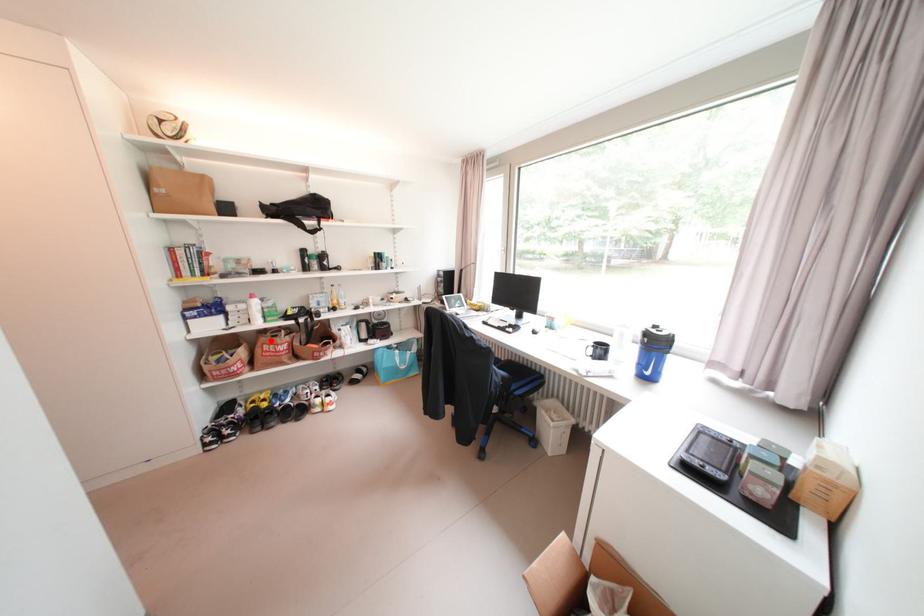
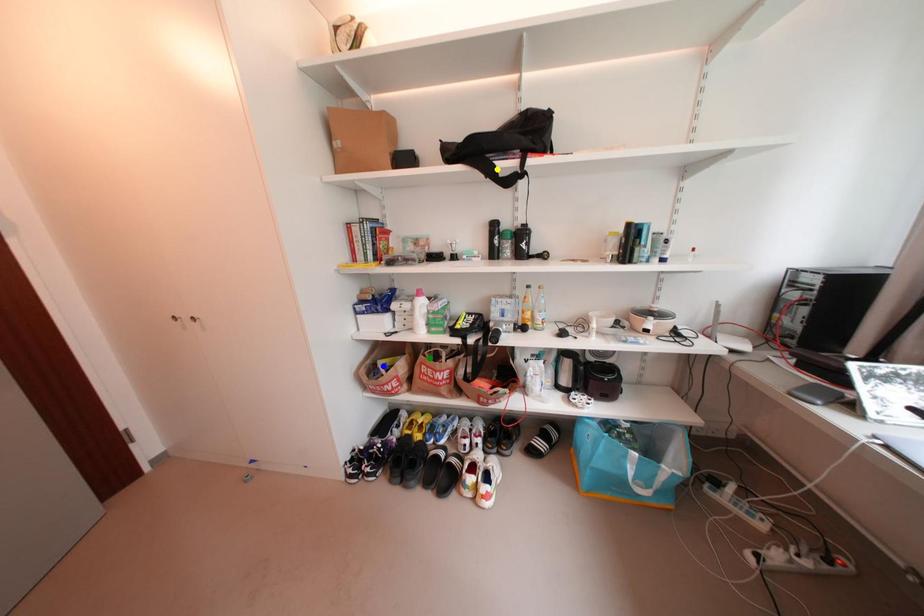
Question: I am providing you with two images of the same scene from different viewpoints. A red point is marked on the first image. You are given multiple points on the second image. Which point in image 2 is actually the same real-world point as the red point in image 1?

Choices:
 (A) green point
 (B) yellow point
 (C) blue point

Answer: (A)